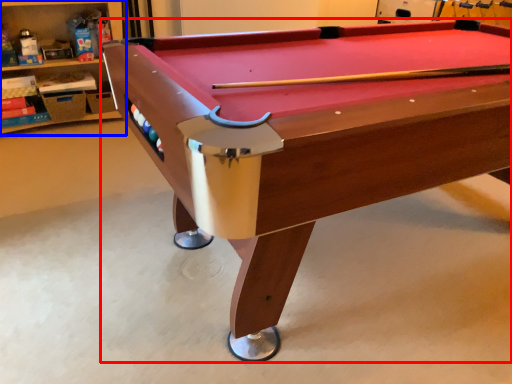
Question: Which object appears farthest to the camera in this image, billiard table (highlighted by a red box) or shelf (highlighted by a blue box)?

Choices:
 (A) billiard table
 (B) shelf

Answer: (B)